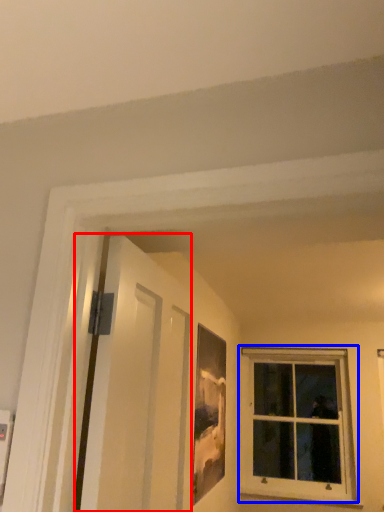
Question: Among these objects, which one is farthest to the camera, screen door (highlighted by a red box) or window (highlighted by a blue box)?

Choices:
 (A) screen door
 (B) window

Answer: (B)